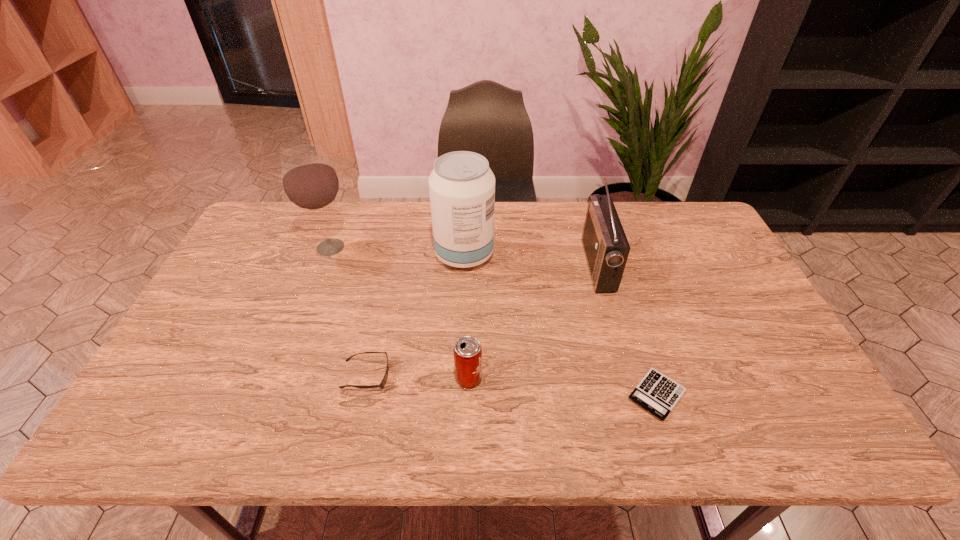
Where is `the left alcohol`? This screenshot has height=540, width=960. the left alcohol is located at coordinates pyautogui.click(x=310, y=182).

At what (x,y) coordinates should I click in order to perform the action: click on the right alcohol. Please return your answer as a coordinate pair (x, y). The height and width of the screenshot is (540, 960). Looking at the image, I should click on (462, 186).

Image resolution: width=960 pixels, height=540 pixels. Find the location of `radio receiver`. radio receiver is located at coordinates (606, 247).

The image size is (960, 540). I want to click on the third shortest object, so click(467, 351).

Identify the location of sunglasses. Image resolution: width=960 pixels, height=540 pixels. (383, 382).

The width and height of the screenshot is (960, 540). I want to click on the fifth tallest object, so click(x=383, y=382).

This screenshot has height=540, width=960. Identify the location of the shortest object. (658, 394).

At what (x,y) coordinates should I click in order to perform the action: click on free location located 0.170m on the front of the leftmost object. Please return your answer as a coordinate pair (x, y). Looking at the image, I should click on (309, 303).

You are a GUI agent. You are given a task and a screenshot of the screen. Output one action in this format:
    pyautogui.click(x=<x>, y=<y>)
    Task: Click on the free location located 0.130m on the right of the right alcohol
    This screenshot has height=540, width=960.
    Given the screenshot: What is the action you would take?
    pyautogui.click(x=534, y=254)

This screenshot has width=960, height=540. I want to click on free region located on the front-facing side of the radio receiver, so click(x=545, y=265).